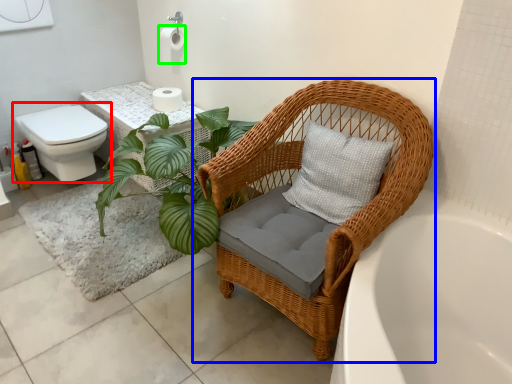
Question: Based on their relative distances, which object is nearer to toilet (highlighted by a red box)? Choose from chair (highlighted by a blue box) and toilet paper (highlighted by a green box).

Choices:
 (A) chair
 (B) toilet paper

Answer: (B)